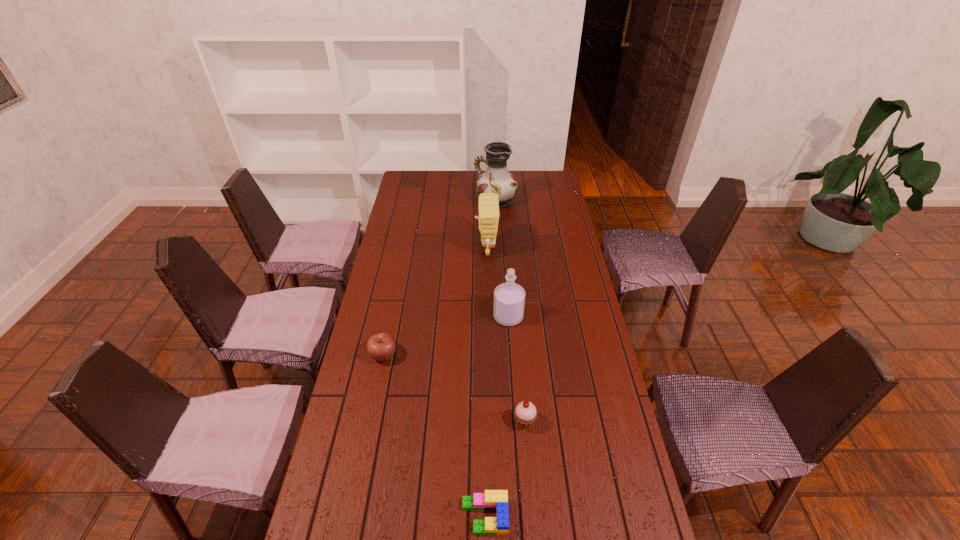
This screenshot has width=960, height=540. I want to click on vacant position located 0.330m on the front of the farthest object, so click(x=498, y=254).

You are a GUI agent. You are given a task and a screenshot of the screen. Output one action in this format:
    pyautogui.click(x=<x>, y=<y>)
    Task: Click on the vacant space located on the face of the second farthest object
    The image size is (960, 540).
    Given the screenshot: What is the action you would take?
    pyautogui.click(x=427, y=249)

This screenshot has width=960, height=540. In order to click on free space located 0.190m on the face of the second farthest object in this screenshot , I will do `click(432, 249)`.

Locate an element on the screen. vacant area located 0.290m on the face of the second farthest object is located at coordinates (409, 249).

Where is `vacant space located on the front of the fourth nearest object`? The image size is (960, 540). vacant space located on the front of the fourth nearest object is located at coordinates (515, 411).

The image size is (960, 540). I want to click on vacant region located on the front of the cupcake, so click(x=533, y=529).

The width and height of the screenshot is (960, 540). What are the coordinates of `free location located on the side of the fifth tallest object with the unique marking` in the screenshot? It's located at (503, 355).

Locate an element on the screen. This screenshot has width=960, height=540. vacant region located on the back of the nearest object is located at coordinates (484, 380).

The height and width of the screenshot is (540, 960). In order to click on object present at the far edge in this screenshot , I will do `click(497, 179)`.

Identify the location of object that is at the left edge. (381, 347).